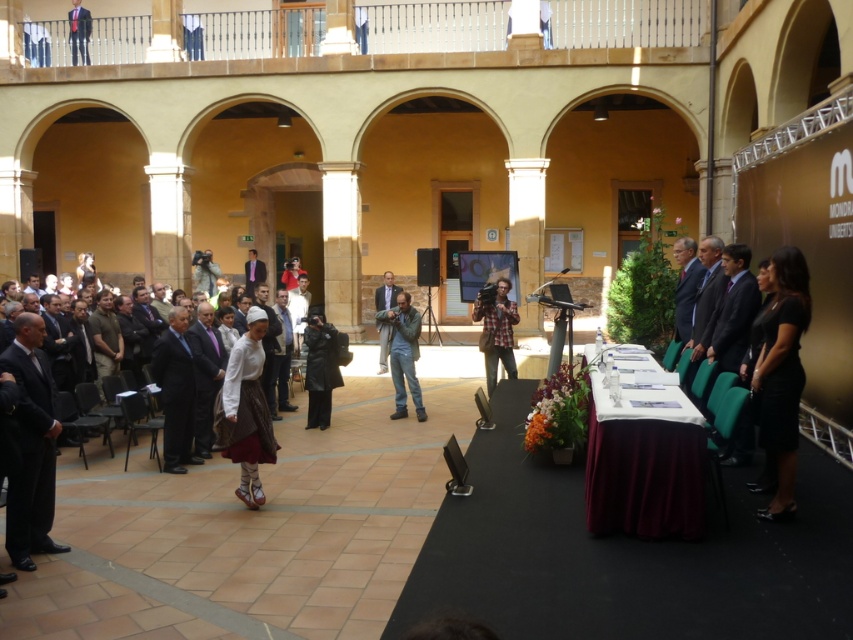
You are attending this event and need to take a photo of the dark blue suit at upper left. The plaid fabric camera at center is on the stage. Can you take the photo without moving the camera?

The plaid fabric camera at center is located below the dark blue suit at upper left, so the camera can capture the dark blue suit at upper left from its current position as it is positioned lower and facing upwards.

You are organizing a presentation and need to place a laptop on the stage. The laptop requires a minimum of 50 cm of space. Given the velvet burgundy table at center and the plaid fabric camera at center, which object can accommodate the laptop based on their sizes?

The velvet burgundy table at center has a larger width than the plaid fabric camera at center, so the velvet burgundy table at center can accommodate the laptop as it provides sufficient space.

You are a photographer at the event and need to position your plaid fabric camera at center to capture the velvet burgundy table at center. In which direction should you move the camera relative to its current position?

The velvet burgundy table at center is to the right of the plaid fabric camera at center, so you should move the plaid fabric camera at center to the right to capture the velvet burgundy table at center.